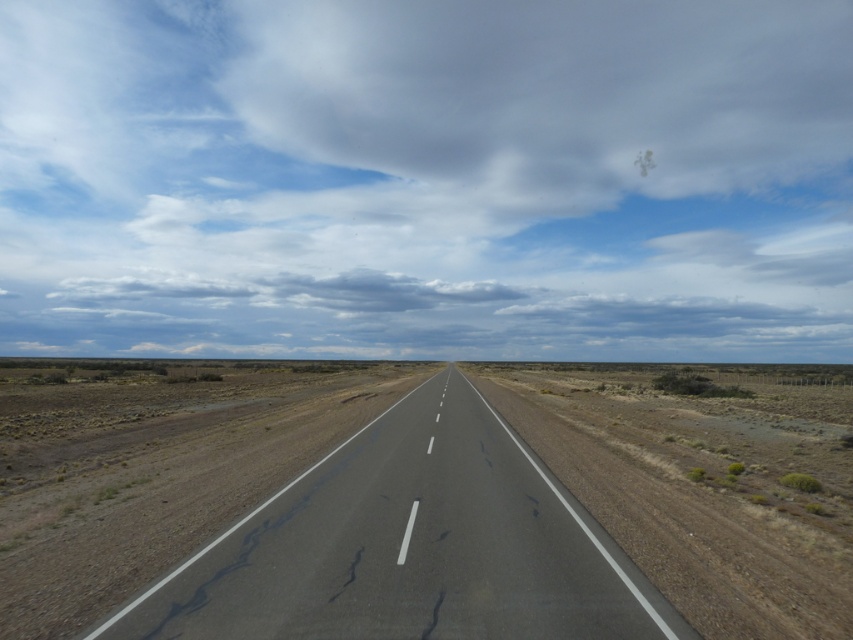
You are a photographer planning to capture the vastness of the desert landscape. You want to include both the white fluffy cloud at upper center and the asphalt road at center in your shot. Which object will appear bigger in the photo?

The white fluffy cloud at upper center will appear bigger in the photo because it has a larger size compared to the asphalt road at center according to the description.

You are a pilot flying a small plane and need to determine if the white fluffy cloud at upper center can fit horizontally over the asphalt road at center. Based on their widths, can the cloud cover the road entirely?

The white fluffy cloud at upper center is wider than the asphalt road at center, so yes, the cloud can cover the road entirely.